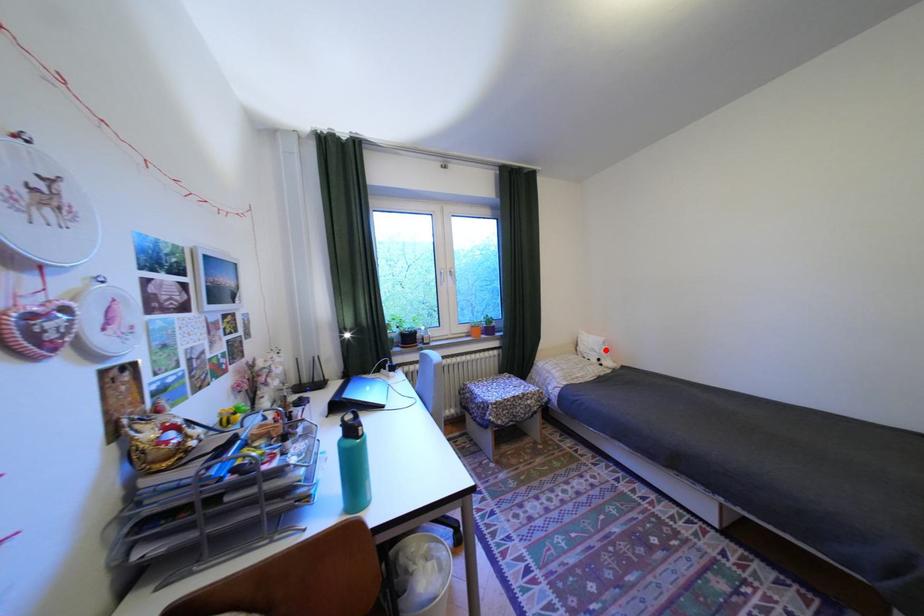
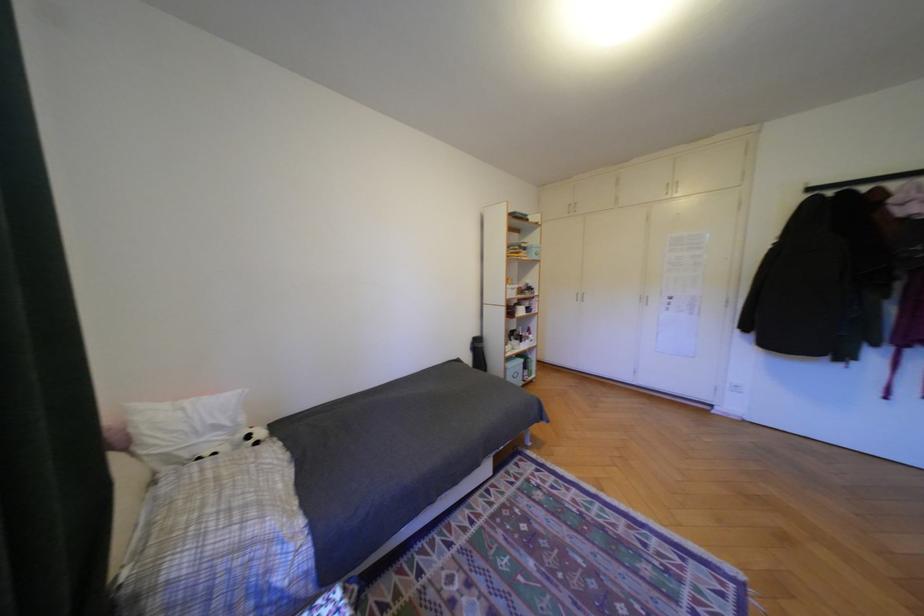
Locate, in the second image, the point that corresponds to the highlighted location in the first image.

(228, 427)